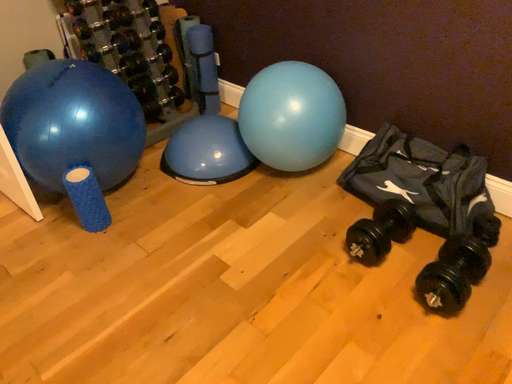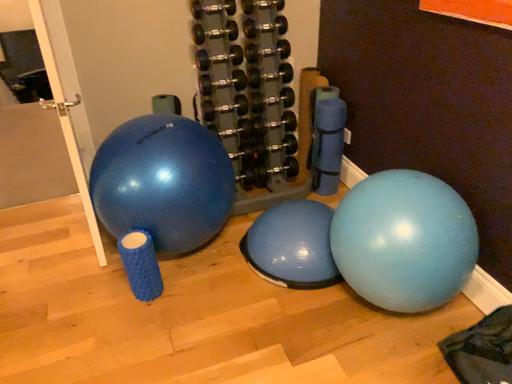
Question: How did the camera likely rotate when shooting the video?

Choices:
 (A) rotated upward
 (B) rotated downward

Answer: (A)